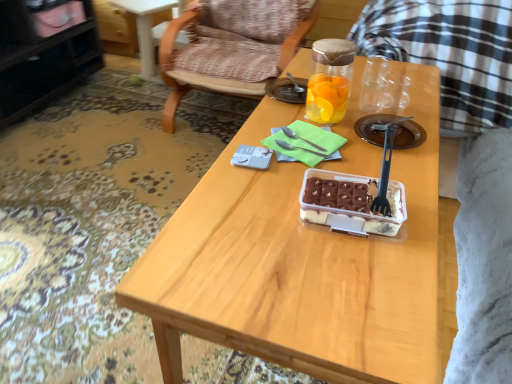
This screenshot has height=384, width=512. What are the coordinates of `free space to the left of satin silver fork at center, which appears as the first fork when viewed from the back` in the screenshot? It's located at (257, 139).